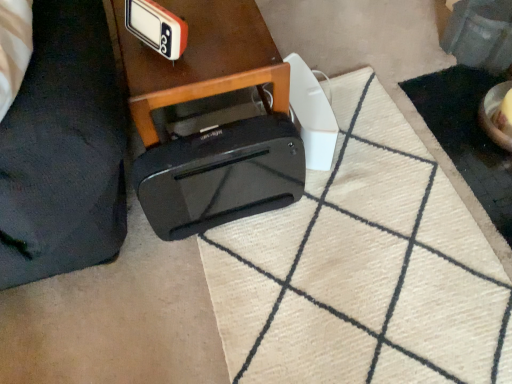
Question: Considering the positions of point (297, 357) and point (222, 86), is point (297, 357) closer or farther from the camera than point (222, 86)?

Choices:
 (A) farther
 (B) closer

Answer: (A)

Question: From the image's perspective, is white textured doormat at lower center positioned above or below black glossy printer at center?

Choices:
 (A) below
 (B) above

Answer: (A)

Question: Estimate the real-world distances between objects in this image. Which object is closer to the black plastic bag at lower left?

Choices:
 (A) white textured doormat at lower center
 (B) orange plastic clock at upper center
 (C) black plastic toaster at lower center
 (D) white plastic speaker at center
 (E) black glossy printer at center

Answer: (E)

Question: Estimate the real-world distances between objects in this image. Which object is farther from the black plastic toaster at lower center?

Choices:
 (A) orange plastic clock at upper center
 (B) white textured doormat at lower center
 (C) black plastic bag at lower left
 (D) black glossy printer at center
 (E) white plastic speaker at center

Answer: (A)